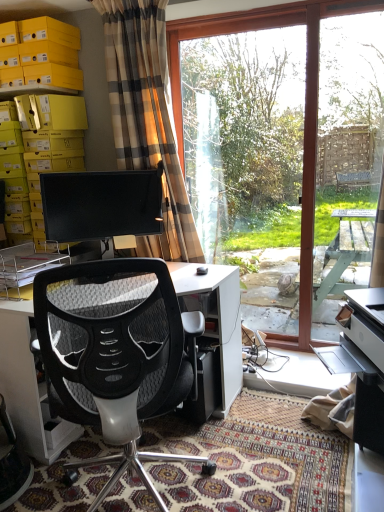
This screenshot has height=512, width=384. What are the coordinates of `yellow cardboard boxes at upper left` in the screenshot? It's located at (40, 55).

In order to face black glossy monitor at center, should I rotate leftwards or rightwards?

Rotate left and turn 11.797 degrees.

Find the location of `black glossy monitor at center`. black glossy monitor at center is located at coordinates (101, 204).

Measure the distance between plaid fabric curtain at upper left and camera.

plaid fabric curtain at upper left and camera are 2.19 meters apart.

This screenshot has height=512, width=384. What do you see at coordinates (116, 355) in the screenshot? I see `black mesh chair at center` at bounding box center [116, 355].

What are the coordinates of `white glossy printer at lower right` in the screenshot? It's located at (362, 362).

In terms of height, does plaid fabric curtain at upper left look taller or shorter compared to black mesh chair at center?

Considering their sizes, plaid fabric curtain at upper left has more height than black mesh chair at center.

Do you think plaid fabric curtain at upper left is within black mesh chair at center, or outside of it?

plaid fabric curtain at upper left is outside black mesh chair at center.

Based on the photo, what's the angular difference between plaid fabric curtain at upper left and black mesh chair at center's facing directions?

6.25 degrees separate the facing orientations of plaid fabric curtain at upper left and black mesh chair at center.

Are plaid fabric curtain at upper left and black mesh chair at center making contact?

Result: No.

In the scene shown: Is white glossy printer at lower right not close to plaid fabric curtain at upper left?

That's right, there is a large distance between white glossy printer at lower right and plaid fabric curtain at upper left.

From the image's perspective, is white glossy printer at lower right located above or below plaid fabric curtain at upper left?

white glossy printer at lower right is below plaid fabric curtain at upper left.

From a real-world perspective, which is physically below, white glossy printer at lower right or plaid fabric curtain at upper left?

white glossy printer at lower right, from a real-world perspective.

From the image's perspective, which object appears higher, transparent glass screen door at right or black mesh chair at center?

transparent glass screen door at right, from the image's perspective.

How different are the orientations of transparent glass screen door at right and black mesh chair at center in degrees?

The angle between the facing direction of transparent glass screen door at right and the facing direction of black mesh chair at center is 2.37 degrees.

Considering the sizes of objects transparent glass screen door at right and black mesh chair at center in the image provided, who is wider, transparent glass screen door at right or black mesh chair at center?

Wider between the two is black mesh chair at center.

Are transparent glass screen door at right and black mesh chair at center beside each other?

A: transparent glass screen door at right and black mesh chair at center are clearly separated.

From the image's perspective, relative to black mesh chair at center, is transparent glass window at center above or below?

Based on their image positions, transparent glass window at center is located above black mesh chair at center.

You are a GUI agent. You are given a task and a screenshot of the screen. Output one action in this format:
    pyautogui.click(x=<x>, y=<y>)
    Task: Click on the window above the black mesh chair at center (from a real-world perspective)
    Image resolution: width=384 pixels, height=512 pixels.
    Given the screenshot: What is the action you would take?
    pyautogui.click(x=284, y=151)

Between transparent glass window at center and black mesh chair at center, which one is positioned behind?

transparent glass window at center is behind.

Considering the sizes of transparent glass window at center and black mesh chair at center in the image, is transparent glass window at center wider or thinner than black mesh chair at center?

transparent glass window at center is thinner than black mesh chair at center.

Between point (375, 434) and point (64, 116), which one is positioned behind?

The point (64, 116) is farther from the camera.

From a real-world perspective, is white glossy printer at lower right on yellow cardboard boxes at upper left?

No, from a real-world perspective, white glossy printer at lower right is not over yellow cardboard boxes at upper left

Who is bigger, white glossy printer at lower right or yellow cardboard boxes at upper left?

yellow cardboard boxes at upper left.

The height and width of the screenshot is (512, 384). Find the location of `shelf that is on the left side of white glossy printer at lower right`. shelf that is on the left side of white glossy printer at lower right is located at coordinates (40, 55).

Based on the photo, is transparent glass screen door at right shorter than yellow cardboard boxes at upper left?

No, transparent glass screen door at right is not shorter than yellow cardboard boxes at upper left.

Which is more to the right, transparent glass screen door at right or yellow cardboard boxes at upper left?

transparent glass screen door at right.

Does transparent glass screen door at right come in front of yellow cardboard boxes at upper left?

Yes, transparent glass screen door at right is closer to the viewer.

How different are the orientations of transparent glass screen door at right and yellow cardboard boxes at upper left in degrees?

They differ by 1.81 degrees in their facing directions.

The height and width of the screenshot is (512, 384). In order to click on shelf on the left of transparent glass window at center in this screenshot , I will do `click(40, 55)`.

Is transparent glass window at center wider or thinner than yellow cardboard boxes at upper left?

Clearly, transparent glass window at center has less width compared to yellow cardboard boxes at upper left.

Is transparent glass window at center beside yellow cardboard boxes at upper left?

There is a gap between transparent glass window at center and yellow cardboard boxes at upper left.

Identify the location of curtain above the black mesh chair at center (from the image's perspective). The height and width of the screenshot is (512, 384). 147,116.

Identify the location of printer located on the right of plaid fabric curtain at upper left. (362, 362).

Based on their spatial positions, is plaid fabric curtain at upper left or black glossy monitor at center further from yellow cardboard boxes at upper left?

Based on the image, plaid fabric curtain at upper left appears to be further to yellow cardboard boxes at upper left.

Estimate the real-world distances between objects in this image. Which object is closer to black mesh chair at center, plaid fabric curtain at upper left or yellow cardboard boxes at upper left?

plaid fabric curtain at upper left lies closer to black mesh chair at center than the other object.

Estimate the real-world distances between objects in this image. Which object is further from yellow cardboard boxes at upper left, black glossy monitor at center or transparent glass screen door at right?

Based on the image, transparent glass screen door at right appears to be further to yellow cardboard boxes at upper left.

Considering their positions, is transparent glass window at center positioned further to black mesh chair at center than transparent glass screen door at right?

transparent glass window at center.

Considering their positions, is transparent glass screen door at right positioned closer to black glossy monitor at center than yellow cardboard boxes at upper left?

yellow cardboard boxes at upper left.

Based on their spatial positions, is black mesh chair at center or plaid fabric curtain at upper left further from yellow cardboard boxes at upper left?

The object further to yellow cardboard boxes at upper left is black mesh chair at center.

Estimate the real-world distances between objects in this image. Which object is further from black mesh chair at center, transparent glass screen door at right or transparent glass window at center?

transparent glass window at center is further to black mesh chair at center.

Based on their spatial positions, is yellow cardboard boxes at upper left or white glossy printer at lower right closer to black glossy monitor at center?

yellow cardboard boxes at upper left.

Locate an element on the screen. This screenshot has width=384, height=512. curtain between black glossy monitor at center and white glossy printer at lower right in the horizontal direction is located at coordinates pyautogui.click(x=147, y=116).

Find the location of `window situated between yellow cardboard boxes at upper left and white glossy printer at lower right from left to right`. window situated between yellow cardboard boxes at upper left and white glossy printer at lower right from left to right is located at coordinates (284, 151).

Where is `computer monitor between yellow cardboard boxes at upper left and white glossy printer at lower right in the horizontal direction`? computer monitor between yellow cardboard boxes at upper left and white glossy printer at lower right in the horizontal direction is located at coordinates (101, 204).

The image size is (384, 512). Find the location of `curtain located between yellow cardboard boxes at upper left and transparent glass screen door at right in the left-right direction`. curtain located between yellow cardboard boxes at upper left and transparent glass screen door at right in the left-right direction is located at coordinates (147, 116).